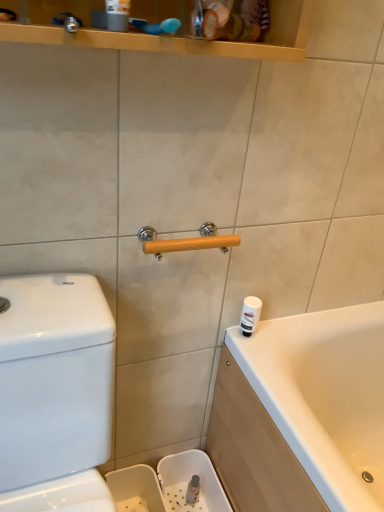
Question: From a real-world perspective, relative to wooden at center, is white glossy water tank at left vertically above or below?

Choices:
 (A) below
 (B) above

Answer: (A)

Question: Considering the positions of white glossy water tank at left and wooden at center in the image, is white glossy water tank at left taller or shorter than wooden at center?

Choices:
 (A) short
 (B) tall

Answer: (B)

Question: Based on their relative distances, which object is farther from the wooden at center?

Choices:
 (A) white glossy water tank at left
 (B) white plastic container at right

Answer: (A)

Question: Which object is positioned closest to the white glossy water tank at left?

Choices:
 (A) wooden at center
 (B) white plastic container at right

Answer: (A)